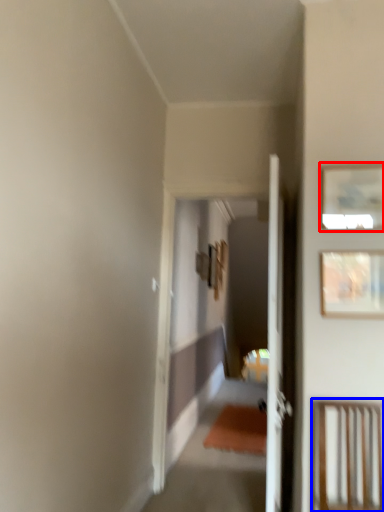
Question: Which object is further to the camera taking this photo, picture frame (highlighted by a red box) or furniture (highlighted by a blue box)?

Choices:
 (A) picture frame
 (B) furniture

Answer: (A)